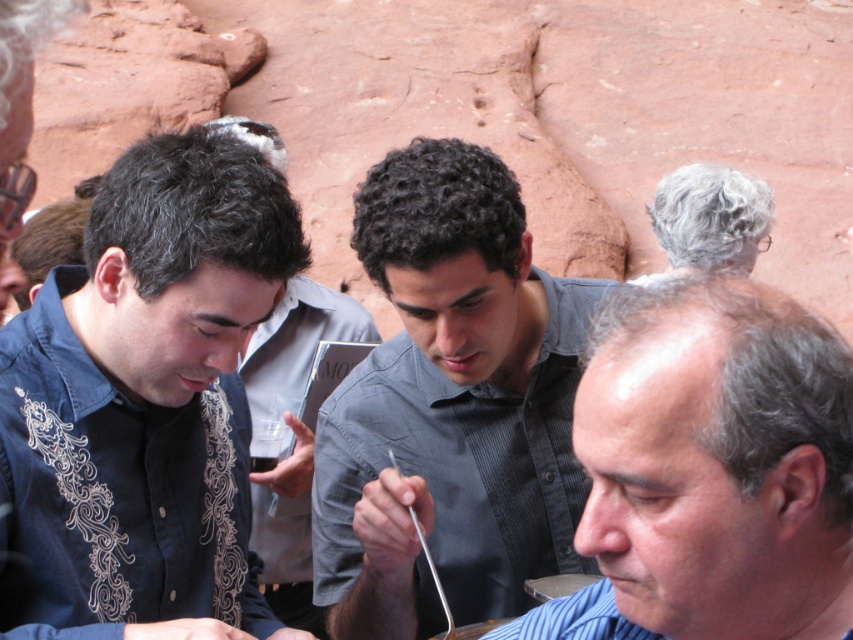
Question: Which object is farther from the camera taking this photo?

Choices:
 (A) dark blue shirt at center
 (B) gray striped shirt at center
 (C) gray curly hair at upper center

Answer: (C)

Question: Which object is closer to the camera taking this photo?

Choices:
 (A) gray curly hair at upper center
 (B) gray textured shirt at center
 (C) gray striped shirt at center

Answer: (C)

Question: Is gray striped shirt at center thinner than dark blue shirt at center?

Choices:
 (A) no
 (B) yes

Answer: (A)

Question: Can you confirm if dark blue denim shirt at left is positioned below gray textured shirt at center?

Choices:
 (A) no
 (B) yes

Answer: (B)

Question: Which point is farther to the camera?

Choices:
 (A) dark blue shirt at center
 (B) dark blue denim shirt at left
 (C) gray striped shirt at center

Answer: (A)

Question: Does gray textured shirt at center appear on the right side of gray curly hair at upper center?

Choices:
 (A) no
 (B) yes

Answer: (A)